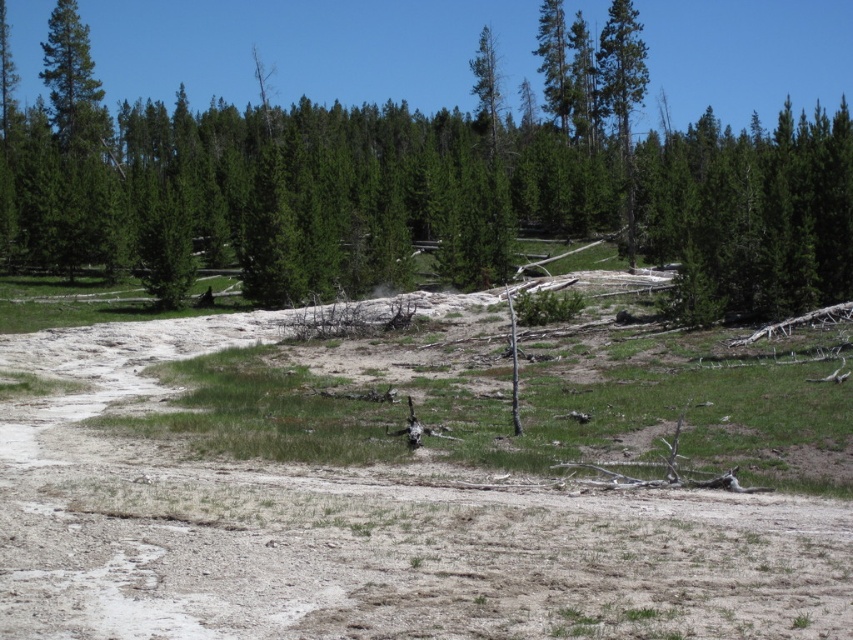
Is green matte tree at center further to camera compared to green matte tree at upper right?

No, green matte tree at center is closer to the viewer.

Does point (190, 148) come behind point (630, 67)?

Yes, point (190, 148) is farther from viewer.

Identify the location of green matte tree at center. The width and height of the screenshot is (853, 640). (422, 180).

What do you see at coordinates (363, 531) in the screenshot? The image size is (853, 640). I see `dull brown dirt field at center` at bounding box center [363, 531].

Can you confirm if dull brown dirt field at center is thinner than green matte tree at upper right?

Correct, dull brown dirt field at center's width is less than green matte tree at upper right's.

At what (x,y) coordinates should I click in order to perform the action: click on dull brown dirt field at center. Please return your answer as a coordinate pair (x, y). This screenshot has height=640, width=853. Looking at the image, I should click on (363, 531).

Where is `dull brown dirt field at center`? dull brown dirt field at center is located at coordinates (363, 531).

Does green matte tree at center appear on the right side of dull brown dirt field at center?

Incorrect, green matte tree at center is not on the right side of dull brown dirt field at center.

Can you confirm if green matte tree at center is positioned below dull brown dirt field at center?

Actually, green matte tree at center is above dull brown dirt field at center.

This screenshot has height=640, width=853. I want to click on green matte tree at center, so click(422, 180).